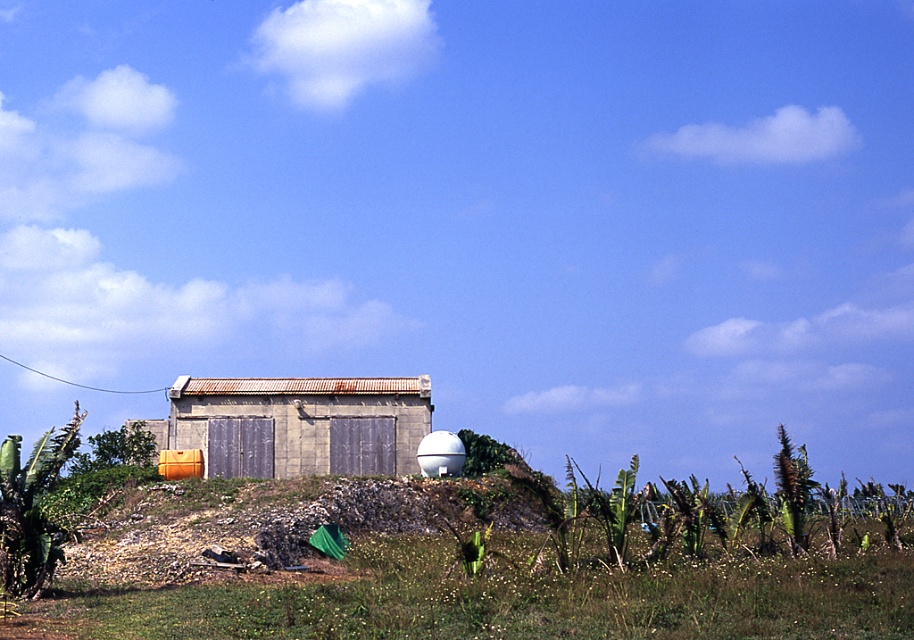
You are a maintenance worker needing to access the white matte water tank at center. The rusty concrete hut at center is blocking your path. Can you reach the water tank without moving the hut?

The rusty concrete hut at center is positioned over the white matte water tank at center, so you cannot reach the water tank without moving the hut.

Looking at this image, you are standing at the point marked by the coordinates point (502, 596). What do you see directly in front of you?

The point (502, 596) marks green grass at lower center, so you would see green grass directly in front of you.